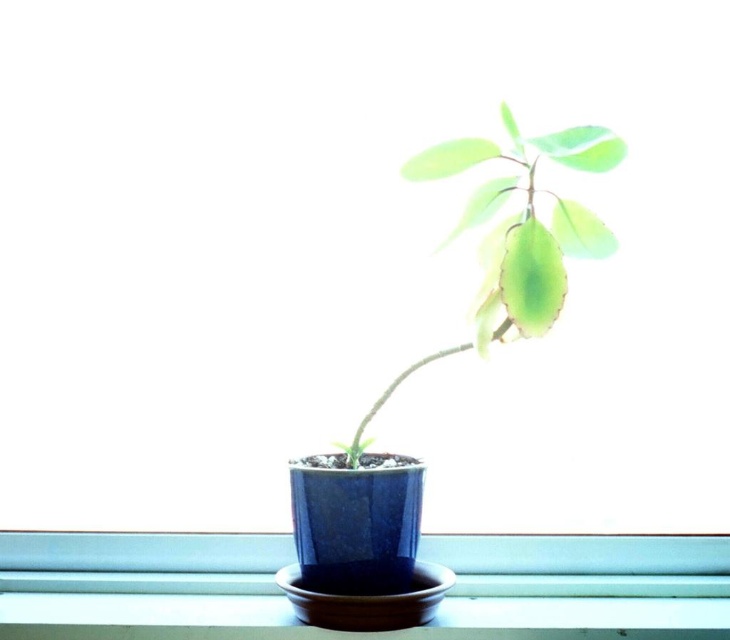
You are a photographer adjusting your camera to capture the potted plant on the windowsill. You notice two points marked in the scene. Which point is closer to your camera lens? The points are point (426, 172) and point (550, 237).

Point (426, 172) is further to the camera than point (550, 237), so the point closer to the camera lens is point (550, 237).

You are standing in front of the windowsill with the potted plant. You need to reach a point that is exactly 30 inches away from you. Can you determine if the point at coordinates point (x=530, y=304) is within reach?

The distance between you and point (x=530, y=304) is 31.53 inches, which is slightly beyond the 30 inches required. Therefore, the point at coordinates point (x=530, y=304) is just out of reach.

You are a gardener checking the growth of the green matte leafy plant at center and the green matte leaf at upper center. Which one has a greater height?

The green matte leafy plant at center is taller than the green matte leaf at upper center.